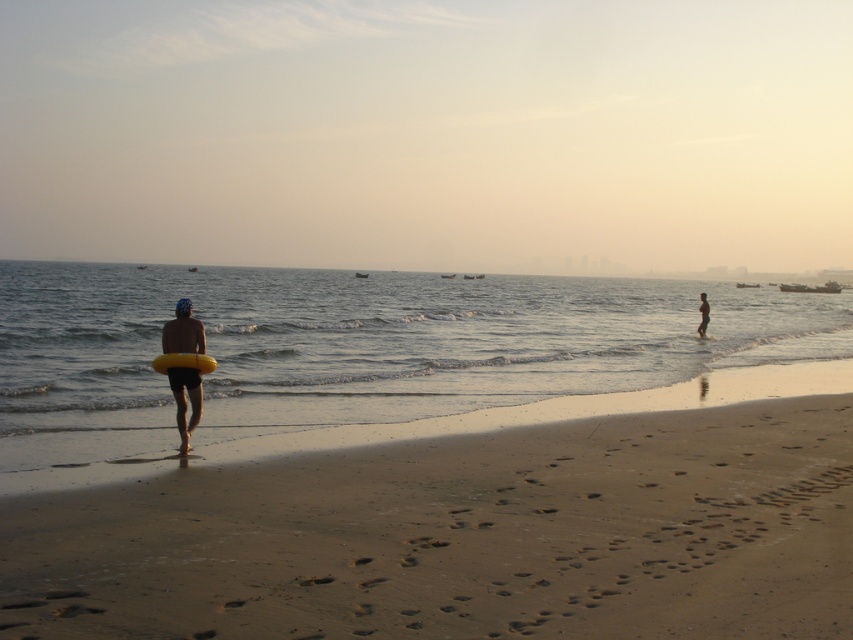
Question: Does sandy yellow at lower left come behind yellow foam surfboard at center?

Choices:
 (A) yes
 (B) no

Answer: (B)

Question: Is sandy yellow at lower left thinner than smooth skin man at right?

Choices:
 (A) yes
 (B) no

Answer: (B)

Question: Where is yellow foam surfboard at center located in relation to smooth skin man at right in the image?

Choices:
 (A) right
 (B) left

Answer: (B)

Question: Among these objects, which one is farthest from the camera?

Choices:
 (A) yellow rubber ring at left
 (B) yellow rubber ring at center
 (C) smooth skin man at right

Answer: (C)

Question: Among these points, which one is farthest from the camera?

Choices:
 (A) (701, 336)
 (B) (166, 362)
 (C) (189, 396)
 (D) (30, 355)

Answer: (A)

Question: Which point is farther from the camera taking this photo?

Choices:
 (A) (201, 369)
 (B) (682, 356)
 (C) (788, 548)

Answer: (B)